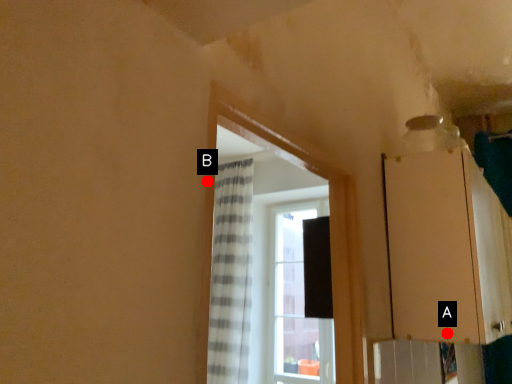
Question: Two points are circled on the image, labeled by A and B beside each circle. Which of the following is the closest to the observer?

Choices:
 (A) A is closer
 (B) B is closer

Answer: (B)